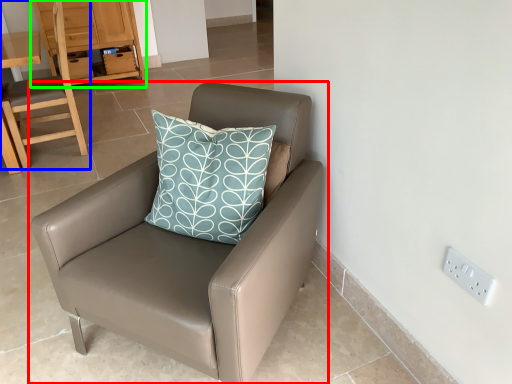
Question: Estimate the real-world distances between objects in this image. Which object is closer to chair (highlighted by a red box), chair (highlighted by a blue box) or dresser (highlighted by a green box)?

Choices:
 (A) chair
 (B) dresser

Answer: (A)